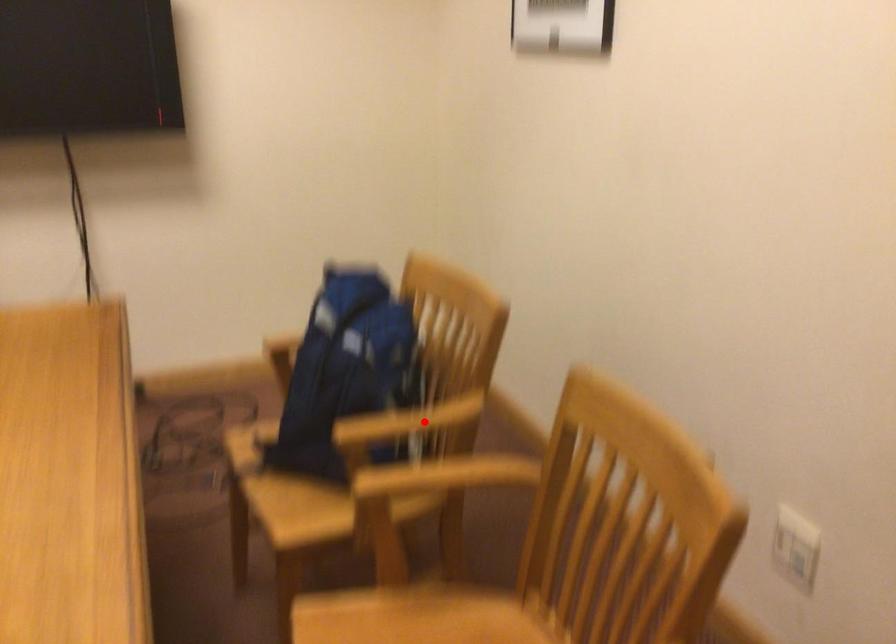
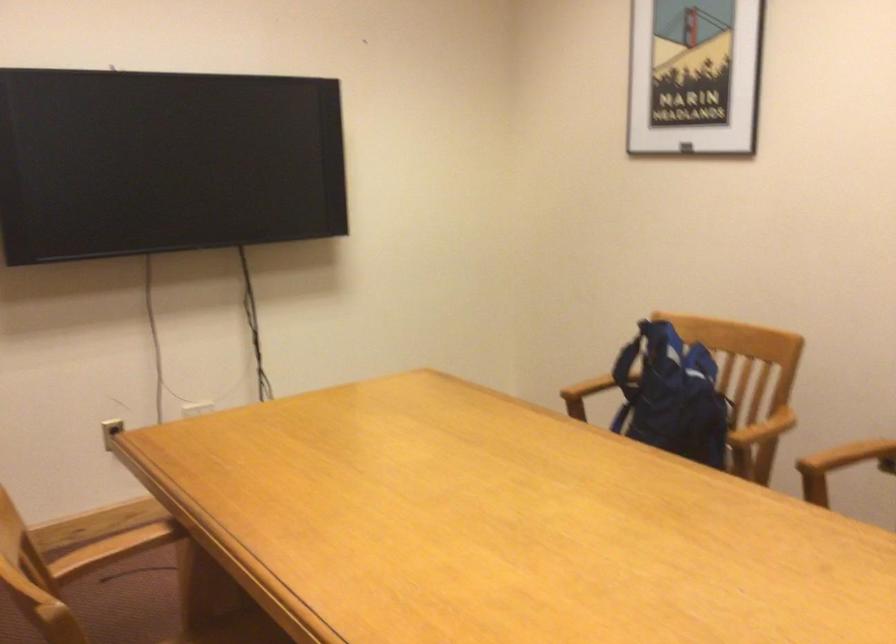
Question: I am providing you with two images of the same scene from different viewpoints. In image1, a red point is highlighted. Considering the same 3D point in image2, which of the following is correct?

Choices:
 (A) It is closer
 (B) It is farther

Answer: (B)